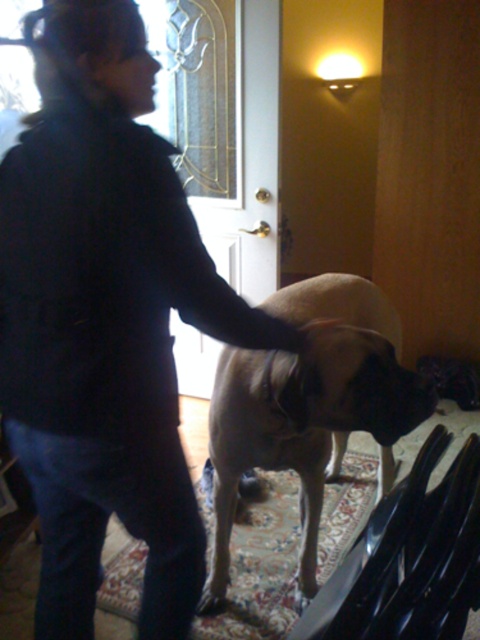
You are standing at the point labeled point (48, 131) and want to walk to the door located at point (408, 432). Is there a clear path between these two points without any obstacles?

Yes, there is a clear path between point (48, 131) and point (408, 432) because the first point is in front of the second point, indicating no obstruction between them.

You are standing in the room and want to pet the dog. Which direction should you move to reach the matte black dog at center first before the light brown fur at center?

Since the matte black dog at center is to the left of the light brown fur at center, you should move to your left to reach the matte black dog at center first before the light brown fur at center.